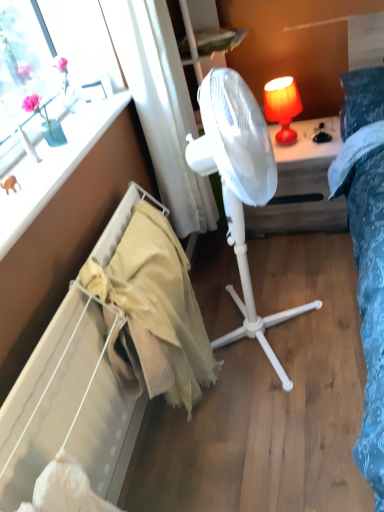
In order to click on vacant location below white sheer curtain at upper center (from a real-world perspective) in this screenshot , I will do `click(213, 264)`.